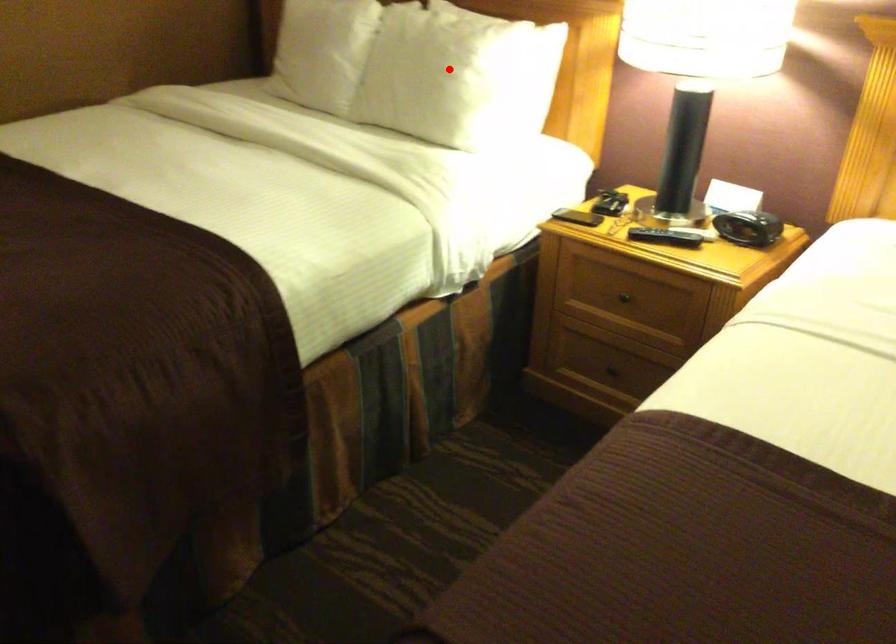
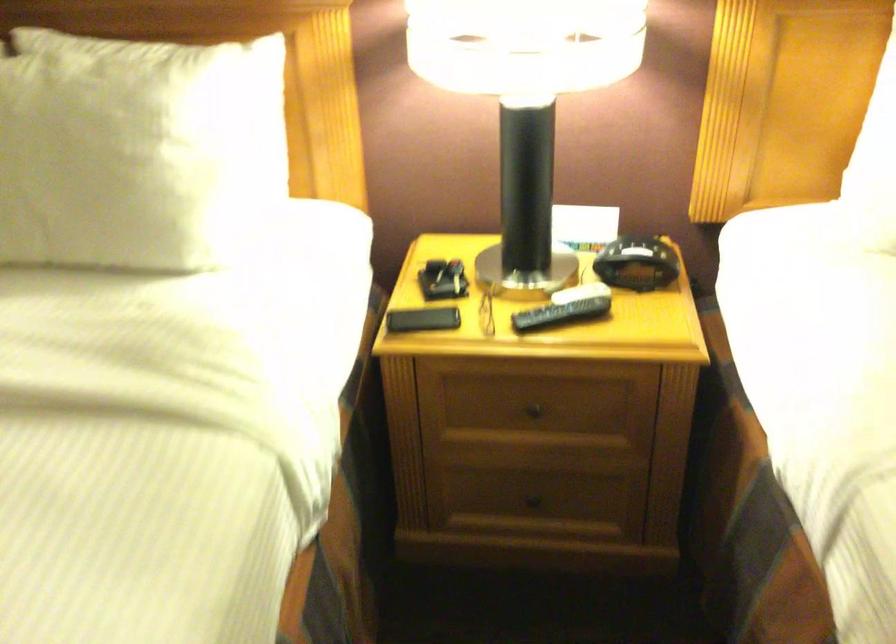
In the second image, find the point that corresponds to the highlighted location in the first image.

(134, 149)